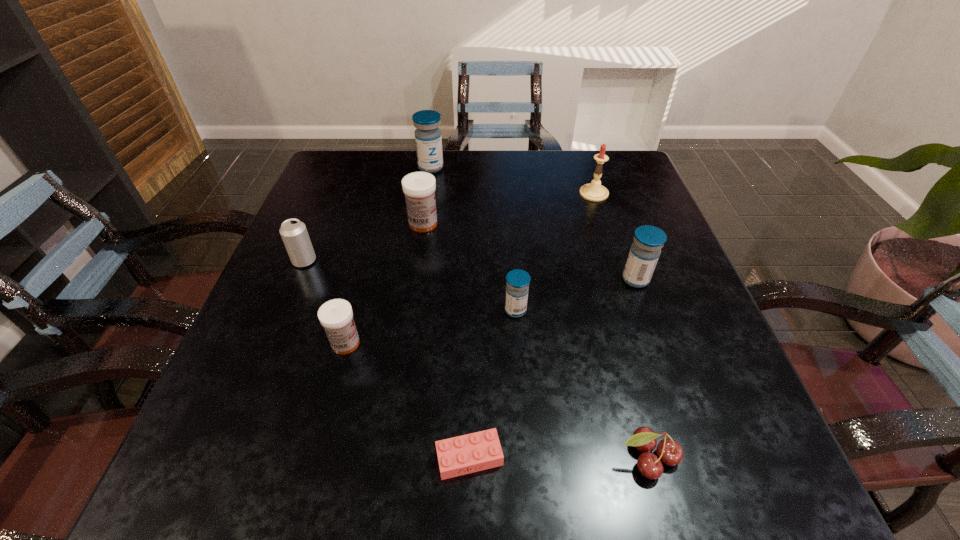
Where is `blank space at the near right corner of the desktop`? blank space at the near right corner of the desktop is located at coordinates (733, 441).

The width and height of the screenshot is (960, 540). I want to click on empty space between the beer can and the nearer white medicine, so click(x=325, y=302).

The width and height of the screenshot is (960, 540). In order to click on free space between the third farthest object and the fifth object from left to right in this screenshot , I will do `click(446, 341)`.

This screenshot has height=540, width=960. I want to click on vacant space that's between the pink Lego and the red cherry, so (559, 458).

Locate an element on the screen. free space that is in between the left white medicine and the candle is located at coordinates (469, 268).

The height and width of the screenshot is (540, 960). I want to click on free space between the cherry and the Lego, so click(x=559, y=458).

I want to click on vacant space that's between the leftmost object and the right white medicine, so click(364, 242).

At what (x,y) coordinates should I click in order to perform the action: click on vacant area that lies between the cherry and the bigger white medicine. Please return your answer as a coordinate pair (x, y). The width and height of the screenshot is (960, 540). Looking at the image, I should click on (536, 341).

The height and width of the screenshot is (540, 960). Find the location of `free spot between the second shortest object and the farthest medicine`. free spot between the second shortest object and the farthest medicine is located at coordinates (540, 313).

The height and width of the screenshot is (540, 960). In order to click on free space between the pink Lego and the candle in this screenshot , I will do `click(532, 326)`.